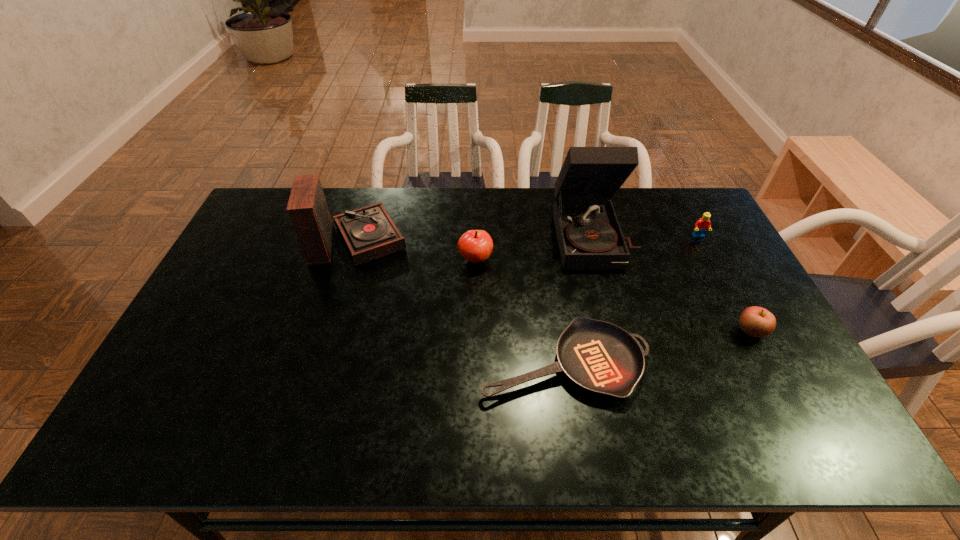
The height and width of the screenshot is (540, 960). In order to click on free spot located 0.400m on the front-facing side of the tallest object in this screenshot , I will do `click(634, 383)`.

Find the location of a particular element. free space located on the front of the leftmost object is located at coordinates (331, 325).

The image size is (960, 540). Identify the location of free space located 0.060m on the left of the fourth shortest object. (440, 260).

Where is `blank space located 0.370m on the face of the Lego`? blank space located 0.370m on the face of the Lego is located at coordinates (746, 327).

Where is `vacant space situated 0.360m on the left of the shorter apple`? The height and width of the screenshot is (540, 960). vacant space situated 0.360m on the left of the shorter apple is located at coordinates (605, 330).

Find the location of a particular element. Image resolution: width=960 pixels, height=540 pixels. free space located 0.220m on the back of the frying pan is located at coordinates (550, 269).

Find the location of a particular element. The image size is (960, 540). Lego at the right edge is located at coordinates (701, 226).

The image size is (960, 540). In order to click on apple that is at the right edge in this screenshot , I will do `click(755, 321)`.

You are a GUI agent. You are given a task and a screenshot of the screen. Output one action in this format:
    pyautogui.click(x=<x>, y=<y>)
    Task: Click on the vacant point at the far edge
    The image size is (960, 540).
    Given the screenshot: What is the action you would take?
    pyautogui.click(x=405, y=198)

This screenshot has width=960, height=540. What are the coordinates of `free location at the left edge of the desktop` in the screenshot? It's located at (201, 360).